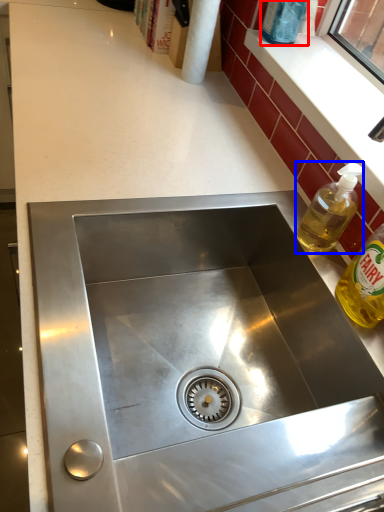
Question: Which point is closer to the camera, bottle (highlighted by a red box) or bottle (highlighted by a blue box)?

Choices:
 (A) bottle
 (B) bottle

Answer: (B)